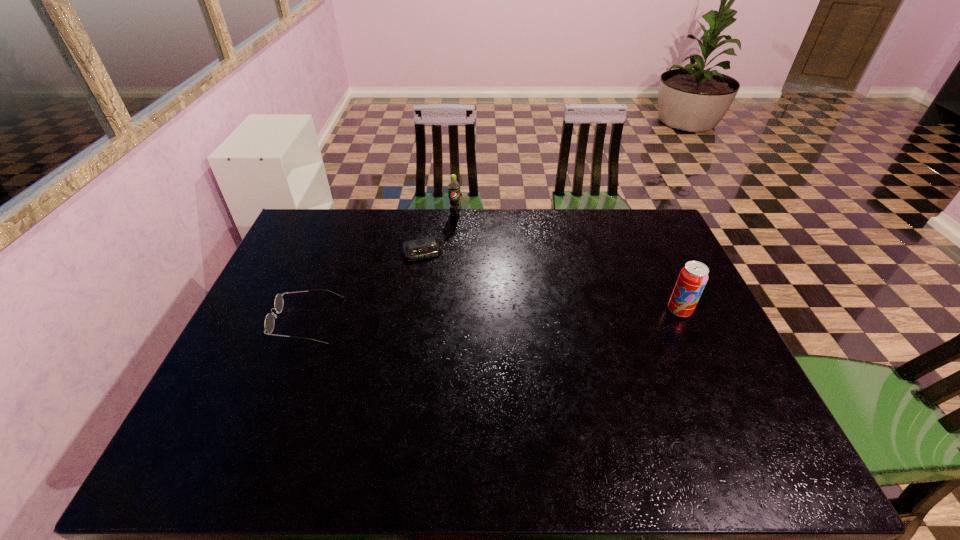
At what (x,y) coordinates should I click in order to perform the action: click on vacant point located between the third tallest object and the third object from left to right. Please return your answer as a coordinate pair (x, y). The image size is (960, 540). Looking at the image, I should click on (381, 267).

The height and width of the screenshot is (540, 960). I want to click on free spot between the third tallest object and the third object from right to left, so click(x=364, y=286).

Where is `free spot between the rightmost object and the farthest object`? Image resolution: width=960 pixels, height=540 pixels. free spot between the rightmost object and the farthest object is located at coordinates (567, 262).

At what (x,y) coordinates should I click in order to perform the action: click on blank region between the third tallest object and the second object from left to right. Please return your answer as a coordinate pair (x, y). The image size is (960, 540). Looking at the image, I should click on (364, 286).

You are a GUI agent. You are given a task and a screenshot of the screen. Output one action in this format:
    pyautogui.click(x=<x>, y=<y>)
    Task: Click on the free space between the third object from left to right and the spectacles
    Image resolution: width=960 pixels, height=540 pixels.
    Given the screenshot: What is the action you would take?
    pyautogui.click(x=381, y=267)

Choose which object is the second nearest neighbor to the left soda. Please provide its 2D coordinates. Your answer should be formatted as a tuple, i.e. [(x, y)], where the tuple contains the x and y coordinates of a point satisfying the conditions above.

[(269, 323)]

Locate which object is the second closest to the farthest object. Please provide its 2D coordinates. Your answer should be formatted as a tuple, i.e. [(x, y)], where the tuple contains the x and y coordinates of a point satisfying the conditions above.

[(269, 323)]

At what (x,y) coordinates should I click in order to perform the action: click on vacant space that satisfies the following two spatial constraints: 1. on the back side of the third object from right to left; 2. on the left side of the farther soda. Please return your answer as a coordinate pair (x, y). The width and height of the screenshot is (960, 540). Looking at the image, I should click on (427, 214).

Locate an element on the screen. vacant space that satisfies the following two spatial constraints: 1. on the front side of the farther soda; 2. on the left side of the rightmost object is located at coordinates (447, 310).

In order to click on free location that satisfies the following two spatial constraints: 1. on the front side of the third nearest object; 2. on the right side of the nearer soda in this screenshot , I will do `click(412, 310)`.